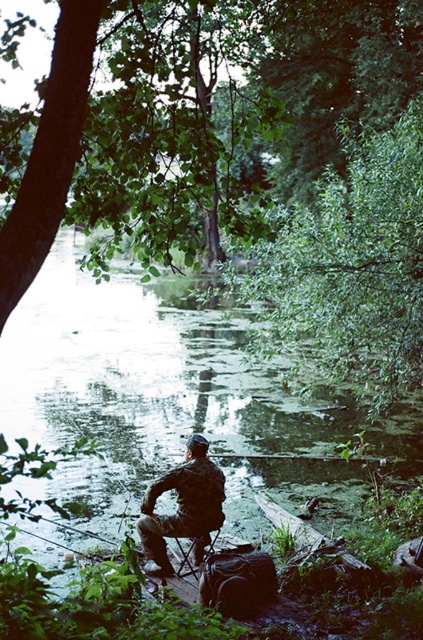
Question: Which of the following is the farthest from the observer?

Choices:
 (A) (395, 60)
 (B) (272, 211)
 (C) (198, 486)

Answer: (A)

Question: Is green leafy tree at upper center below metallic folding chair at center?

Choices:
 (A) no
 (B) yes

Answer: (A)

Question: Is the position of green leafy tree at upper center less distant than that of metallic folding chair at center?

Choices:
 (A) yes
 (B) no

Answer: (B)

Question: Among these points, which one is nearest to the camera?

Choices:
 (A) (335, 358)
 (B) (307, 26)
 (C) (195, 538)
 (D) (214, 541)

Answer: (C)

Question: Considering the real-world distances, which object is closest to the green leafy tree at upper left?

Choices:
 (A) metallic folding chair at center
 (B) green leafy tree at upper center

Answer: (B)

Question: Is camouflage fabric fisherman at center further to camera compared to metallic folding chair at center?

Choices:
 (A) yes
 (B) no

Answer: (B)